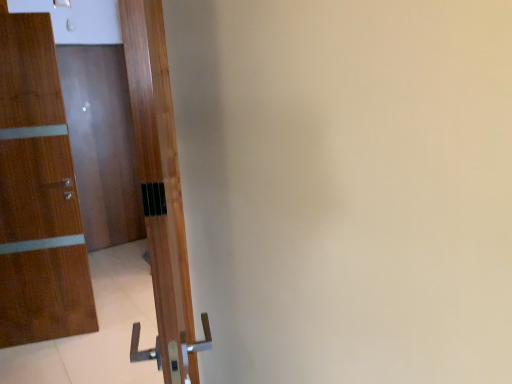
Question: Considering the relative positions of wooden door at left, the second door from the back, and wooden door at left, acting as the third door starting from the left, in the image provided, is wooden door at left, the second door from the back, to the left or to the right of wooden door at left, acting as the third door starting from the left,?

Choices:
 (A) left
 (B) right

Answer: (A)

Question: Does point (55, 134) appear closer or farther from the camera than point (202, 329)?

Choices:
 (A) farther
 (B) closer

Answer: (A)

Question: Which of these objects is positioned farthest from the wooden door at left, acting as the third door starting from the left?

Choices:
 (A) wooden door at left, the second door viewed from the left
 (B) glossy wood door at left, the 3th door when ordered from right to left

Answer: (B)

Question: Which of these objects is positioned closest to the wooden door at left, positioned as the third door in back-to-front order?

Choices:
 (A) glossy wood door at left, which is counted as the 3th door, starting from the front
 (B) wooden door at left, acting as the second door starting from the front

Answer: (B)